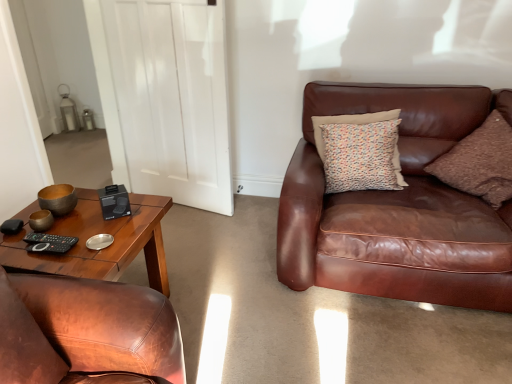
Locate an element on the screen. The width and height of the screenshot is (512, 384). matte brown pillow at lower left, which is counted as the 3th pillow, starting from the back is located at coordinates (24, 343).

What do you see at coordinates (360, 151) in the screenshot? I see `multicolored fabric pillow at upper right, which is counted as the second pillow, starting from the left` at bounding box center [360, 151].

The width and height of the screenshot is (512, 384). Describe the element at coordinates (480, 162) in the screenshot. I see `brown corduroy pillow at right, the 2th pillow viewed from the back` at that location.

Locate an element on the screen. brown leather chair at left is located at coordinates (85, 331).

You are a GUI agent. You are given a task and a screenshot of the screen. Output one action in this format:
    pyautogui.click(x=<x>, y=<y>)
    Task: Click on the matte brown pillow at lower left, which is counted as the first pillow, starting from the front
    
    Given the screenshot: What is the action you would take?
    pyautogui.click(x=24, y=343)

Is brown corduroy pillow at right, the 2th pillow positioned from the front, beside matte brown pillow at lower left, acting as the first pillow starting from the left?

No, brown corduroy pillow at right, the 2th pillow positioned from the front, is not making contact with matte brown pillow at lower left, acting as the first pillow starting from the left.

How much distance is there between brown corduroy pillow at right, the 2th pillow viewed from the back, and matte brown pillow at lower left, arranged as the third pillow when viewed from the right?

brown corduroy pillow at right, the 2th pillow viewed from the back, and matte brown pillow at lower left, arranged as the third pillow when viewed from the right, are 6.63 feet apart.

From a real-world perspective, is brown corduroy pillow at right, the 2th pillow viewed from the back, located higher than matte brown pillow at lower left, which is counted as the first pillow, starting from the front?

Incorrect, from a real-world perspective, brown corduroy pillow at right, the 2th pillow viewed from the back, is lower than matte brown pillow at lower left, which is counted as the first pillow, starting from the front.

Does brown corduroy pillow at right, the 3th pillow viewed from the left, appear on the right side of matte brown pillow at lower left, arranged as the third pillow when viewed from the right?

Indeed, brown corduroy pillow at right, the 3th pillow viewed from the left, is positioned on the right side of matte brown pillow at lower left, arranged as the third pillow when viewed from the right.

Which object is more forward, black matte remote at lower left or brown corduroy pillow at right, the 2th pillow positioned from the front?

black matte remote at lower left is more forward.

In the scene shown: Would you say black matte remote at lower left is inside or outside brown corduroy pillow at right, the 2th pillow positioned from the front?

black matte remote at lower left is spatially situated outside brown corduroy pillow at right, the 2th pillow positioned from the front.

Can you confirm if black matte remote at lower left is smaller than brown corduroy pillow at right, the 2th pillow positioned from the front?

Yes.

From the picture: Is brown leather couch at right facing away from matte brown pillow at lower left, arranged as the third pillow when viewed from the right?

That's not correct — brown leather couch at right is not looking away from matte brown pillow at lower left, arranged as the third pillow when viewed from the right.

Who is smaller, brown leather couch at right or matte brown pillow at lower left, which is counted as the first pillow, starting from the front?

Smaller between the two is matte brown pillow at lower left, which is counted as the first pillow, starting from the front.

Measure the distance between brown leather couch at right and matte brown pillow at lower left, which is counted as the 3th pillow, starting from the back.

brown leather couch at right and matte brown pillow at lower left, which is counted as the 3th pillow, starting from the back, are 1.46 meters apart.

From the image's perspective, which one is positioned higher, brown leather couch at right or matte brown pillow at lower left, arranged as the third pillow when viewed from the right?

brown leather couch at right is shown above in the image.

In terms of size, does brown corduroy pillow at right, the 2th pillow viewed from the back, appear bigger or smaller than black matte remote at lower left?

brown corduroy pillow at right, the 2th pillow viewed from the back, is bigger than black matte remote at lower left.

Which object is positioned more to the right, brown corduroy pillow at right, which ranks as the first pillow in right-to-left order, or black matte remote at lower left?

From the viewer's perspective, brown corduroy pillow at right, which ranks as the first pillow in right-to-left order, appears more on the right side.

Does brown corduroy pillow at right, the 3th pillow viewed from the left, have a lesser height compared to black matte remote at lower left?

No.

From a real-world perspective, which is physically above, black matte remote at lower left or matte brown pillow at lower left, which is counted as the first pillow, starting from the front?

matte brown pillow at lower left, which is counted as the first pillow, starting from the front, from a real-world perspective.

From the image's perspective, is black matte remote at lower left below matte brown pillow at lower left, acting as the first pillow starting from the left?

No, from the image's perspective, black matte remote at lower left is not beneath matte brown pillow at lower left, acting as the first pillow starting from the left.

Considering the relative positions of black matte remote at lower left and matte brown pillow at lower left, acting as the first pillow starting from the left, in the image provided, is black matte remote at lower left in front of matte brown pillow at lower left, acting as the first pillow starting from the left,?

No, it is behind matte brown pillow at lower left, acting as the first pillow starting from the left.

Is point (73, 243) closer to camera compared to point (53, 355)?

No.

Who is shorter, matte brown pillow at lower left, acting as the first pillow starting from the left, or black matte remote at lower left?

With less height is black matte remote at lower left.

How different are the orientations of matte brown pillow at lower left, acting as the first pillow starting from the left, and black matte remote at lower left in degrees?

2.26 degrees.

Considering the relative sizes of matte brown pillow at lower left, which is counted as the first pillow, starting from the front, and black matte remote at lower left in the image provided, is matte brown pillow at lower left, which is counted as the first pillow, starting from the front, wider than black matte remote at lower left?

Correct, the width of matte brown pillow at lower left, which is counted as the first pillow, starting from the front, exceeds that of black matte remote at lower left.

Looking at this image, is black matte remote at lower left beside brown leather couch at right?

There is a gap between black matte remote at lower left and brown leather couch at right.

This screenshot has width=512, height=384. In order to click on studio couch on the right of black matte remote at lower left in this screenshot , I will do [397, 207].

Considering the relative sizes of black matte remote at lower left and brown leather couch at right in the image provided, is black matte remote at lower left thinner than brown leather couch at right?

Correct, the width of black matte remote at lower left is less than that of brown leather couch at right.

Locate an element on the screen. The width and height of the screenshot is (512, 384). pillow that appears in front of the brown corduroy pillow at right, the 2th pillow viewed from the back is located at coordinates (24, 343).

In order to click on the 1st pillow above the black matte remote at lower left (from a real-world perspective) in this screenshot , I will do `click(480, 162)`.

Based on their spatial positions, is brown corduroy pillow at right, the 2th pillow viewed from the back, or black matte remote at lower left further from brown leather chair at left?

brown corduroy pillow at right, the 2th pillow viewed from the back.

When comparing their distances from brown leather chair at left, does matte brown pillow at lower left, which is counted as the first pillow, starting from the front, or brown corduroy pillow at right, the 2th pillow positioned from the front, seem further?

The object further to brown leather chair at left is brown corduroy pillow at right, the 2th pillow positioned from the front.

In the scene shown: Looking at the image, which one is located further to multicolored fabric pillow at upper right, placed as the second pillow when sorted from right to left, brown leather couch at right or brown corduroy pillow at right, the 3th pillow viewed from the left?

brown corduroy pillow at right, the 3th pillow viewed from the left, is positioned further to the anchor multicolored fabric pillow at upper right, placed as the second pillow when sorted from right to left.

Estimate the real-world distances between objects in this image. Which object is closer to brown leather chair at left, matte brown pillow at lower left, acting as the first pillow starting from the left, or brown leather couch at right?

matte brown pillow at lower left, acting as the first pillow starting from the left, lies closer to brown leather chair at left than the other object.

From the picture: Estimate the real-world distances between objects in this image. Which object is closer to brown leather chair at left, brown leather couch at right or brown corduroy pillow at right, the 2th pillow viewed from the back?

brown leather couch at right is positioned closer to the anchor brown leather chair at left.

Looking at the image, which one is located further to brown leather couch at right, brown corduroy pillow at right, which ranks as the first pillow in right-to-left order, or multicolored fabric pillow at upper right, placed as the second pillow when sorted from right to left?

brown corduroy pillow at right, which ranks as the first pillow in right-to-left order.

Looking at the image, which one is located further to brown leather chair at left, multicolored fabric pillow at upper right, placed as the second pillow when sorted from right to left, or brown leather couch at right?

Among the two, multicolored fabric pillow at upper right, placed as the second pillow when sorted from right to left, is located further to brown leather chair at left.

Looking at the image, which one is located further to brown leather chair at left, black matte remote at lower left or brown corduroy pillow at right, which ranks as the first pillow in right-to-left order?

The object further to brown leather chair at left is brown corduroy pillow at right, which ranks as the first pillow in right-to-left order.

At what (x,y) coordinates should I click in order to perform the action: click on pillow located between brown leather chair at left and multicolored fabric pillow at upper right, placed as the second pillow when sorted from right to left, in the left-right direction. Please return your answer as a coordinate pair (x, y). The height and width of the screenshot is (384, 512). Looking at the image, I should click on (24, 343).

Identify the location of chair between black matte remote at lower left and multicolored fabric pillow at upper right, which is counted as the 3th pillow, starting from the front, in the horizontal direction. The height and width of the screenshot is (384, 512). (85, 331).

The image size is (512, 384). In order to click on pillow located between black matte remote at lower left and multicolored fabric pillow at upper right, which is counted as the second pillow, starting from the left, in the left-right direction in this screenshot , I will do point(24,343).

The width and height of the screenshot is (512, 384). Identify the location of studio couch situated between black matte remote at lower left and brown corduroy pillow at right, which ranks as the first pillow in right-to-left order, from left to right. (397, 207).